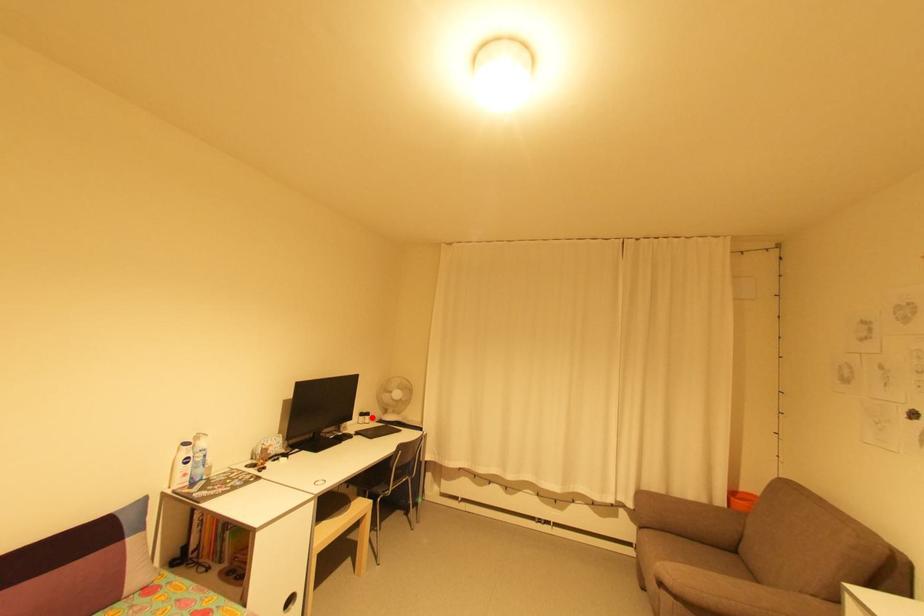
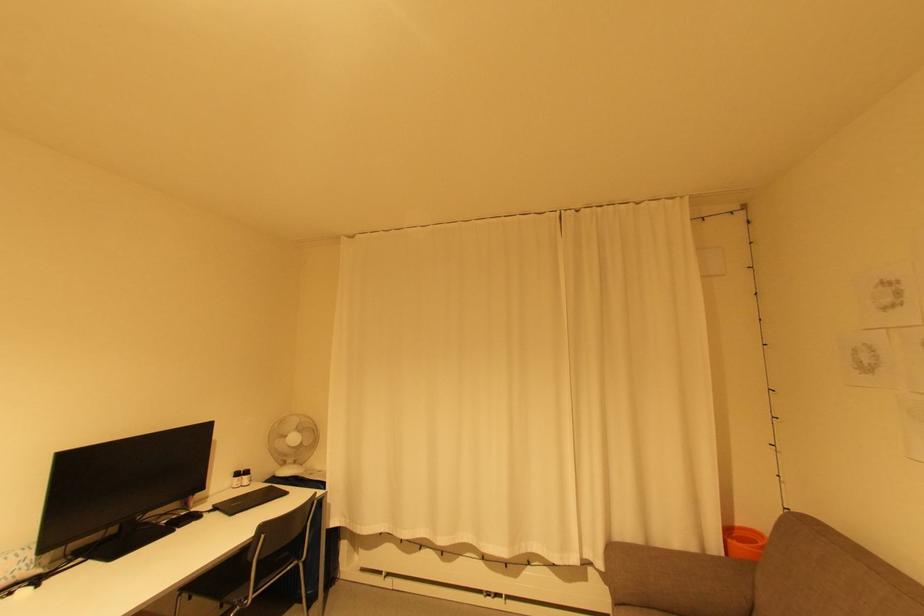
Locate, in the second image, the point that corresponds to the highlighted location in the first image.

(250, 477)